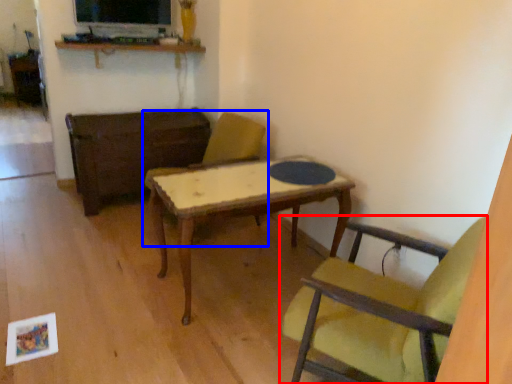
Question: Which object is further to the camera taking this photo, chair (highlighted by a red box) or chair (highlighted by a blue box)?

Choices:
 (A) chair
 (B) chair

Answer: (B)